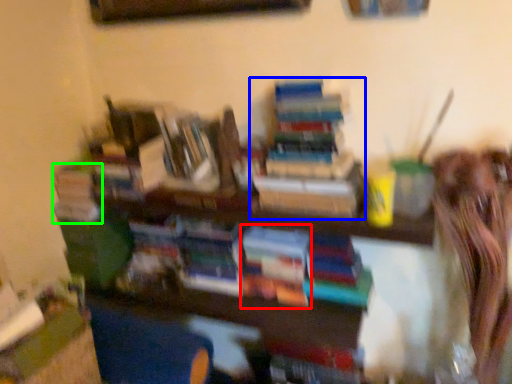
Question: Based on their relative distances, which object is farther from book (highlighted by a red box)? Choose from book (highlighted by a blue box) and book (highlighted by a green box).

Choices:
 (A) book
 (B) book

Answer: (B)